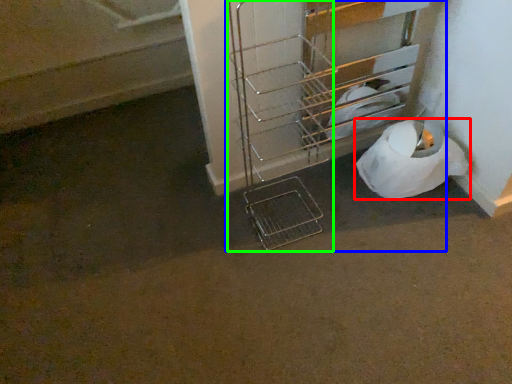
Question: Considering the real-world distances, which object is farthest from toilet paper (highlighted by a red box)? trolley (highlighted by a blue box) or trolley (highlighted by a green box)?

Choices:
 (A) trolley
 (B) trolley

Answer: (B)